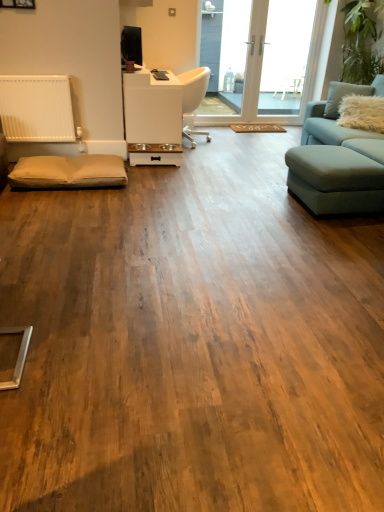
Question: Based on their positions, is transparent glass door at upper center, placed as the first window screen when sorted from left to right, located to the left or right of white plastic chair at center?

Choices:
 (A) left
 (B) right

Answer: (B)

Question: Looking at their shapes, would you say transparent glass door at upper center, placed as the first window screen when sorted from left to right, is wider or thinner than white plastic chair at center?

Choices:
 (A) wide
 (B) thin

Answer: (B)

Question: Estimate the real-world distances between objects in this image. Which object is closer to the light blue fabric couch at right?

Choices:
 (A) beige fabric footrest at lower left
 (B) fuzzy white pillow at upper right
 (C) white plastic chair at center
 (D) transparent glass door at upper center, placed as the first window screen when sorted from left to right
 (E) white glossy table at center

Answer: (B)

Question: Considering the real-world distances, which object is closest to the beige fabric footrest at lower left?

Choices:
 (A) transparent glass door at upper center, placed as the first window screen when sorted from left to right
 (B) transparent glass door at upper right, marked as the 2th window screen in a left-to-right arrangement
 (C) white glossy table at center
 (D) light blue fabric couch at right
 (E) white plastic chair at center

Answer: (C)